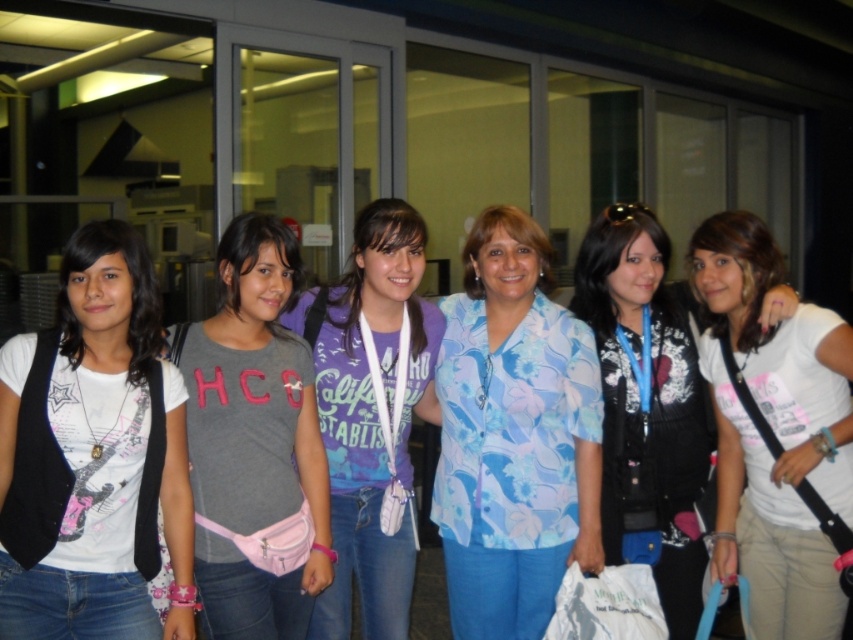
You are a photographer trying to capture a photo of the group where both the gray fabric shirt at center and the floral print blouse at center are clearly visible. Since you want both to be in focus, which person should you adjust the camera focus on first?

Answer: The gray fabric shirt at center is not as tall as the floral print blouse at center, so you should focus on the floral print blouse at center first to ensure both are in focus.

You are a photographer trying to capture a clear shot of the purple cotton shirt at center and the floral print blouse at center. Which one is positioned lower in the image?

The purple cotton shirt at center is below the floral print blouse at center, so the purple cotton shirt at center is positioned lower in the image.

You are a photographer trying to frame a group photo. You need to ensure that both the gray fabric shirt at center and the floral print blouse at center are fully visible in the shot. Based on their positions and sizes, which one should you focus on to avoid cropping either of them?

The gray fabric shirt at center might be wider than floral print blouse at center, so focusing on the gray fabric shirt at center would ensure both are fully visible as it requires more space.